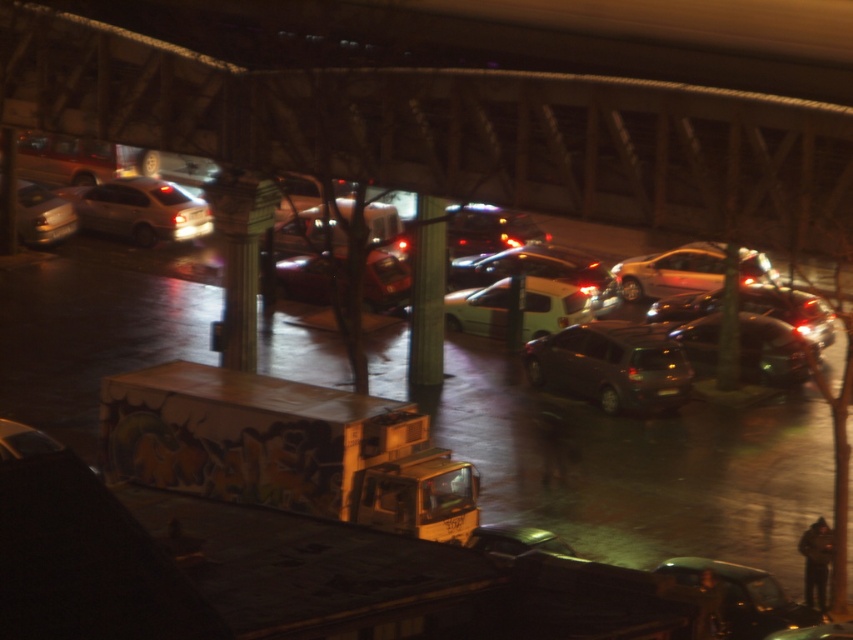
You are standing at the origin point of the coordinate system in the image. You want to move towards the shiny silver sedan at left. What direction should you move in based on the coordinate system?

The shiny silver sedan at left is located at coordinate point 0.328 on the x axis and 0.165 on the y axis. Since you are at the origin, you should move in the positive x and positive y direction to reach it.